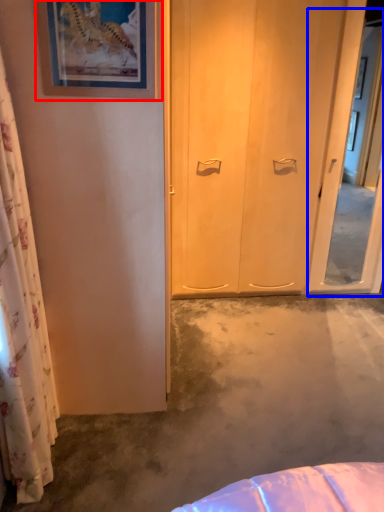
Question: Which of the following is the farthest to the observer, picture frame (highlighted by a red box) or screen door (highlighted by a blue box)?

Choices:
 (A) picture frame
 (B) screen door

Answer: (B)